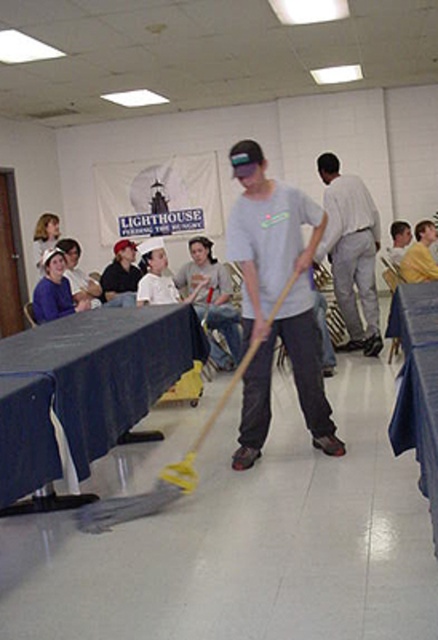
Describe the element at coordinates (89, 385) in the screenshot. This screenshot has width=438, height=640. I see `blue fabric tablecloth at lower left` at that location.

Between blue fabric tablecloth at lower left and dark blue jeans at center, which one has less height?

With less height is dark blue jeans at center.

What do you see at coordinates (89, 385) in the screenshot? This screenshot has width=438, height=640. I see `blue fabric tablecloth at lower left` at bounding box center [89, 385].

Image resolution: width=438 pixels, height=640 pixels. What are the coordinates of `blue fabric tablecloth at lower left` in the screenshot? It's located at (89, 385).

Is blue fabric tablecloth at lower left positioned at the back of yellow shirt at upper right?

No.

Which is in front, point (168, 332) or point (434, 230)?

Point (168, 332) is in front.

The height and width of the screenshot is (640, 438). Identify the location of blue fabric tablecloth at lower left. (89, 385).

Is light gray pants at center above light gray t-shirt at center?

Indeed, light gray pants at center is positioned over light gray t-shirt at center.

Identify the location of light gray pants at center. (352, 252).

Is point (359, 326) positioned after point (221, 296)?

Yes, point (359, 326) is behind point (221, 296).

The width and height of the screenshot is (438, 640). Identify the location of light gray pants at center. (352, 252).